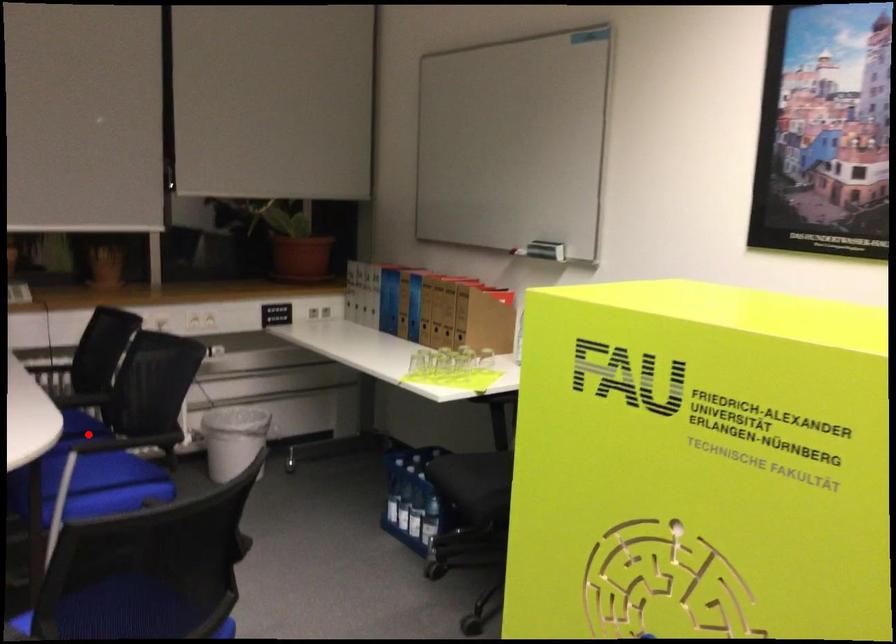
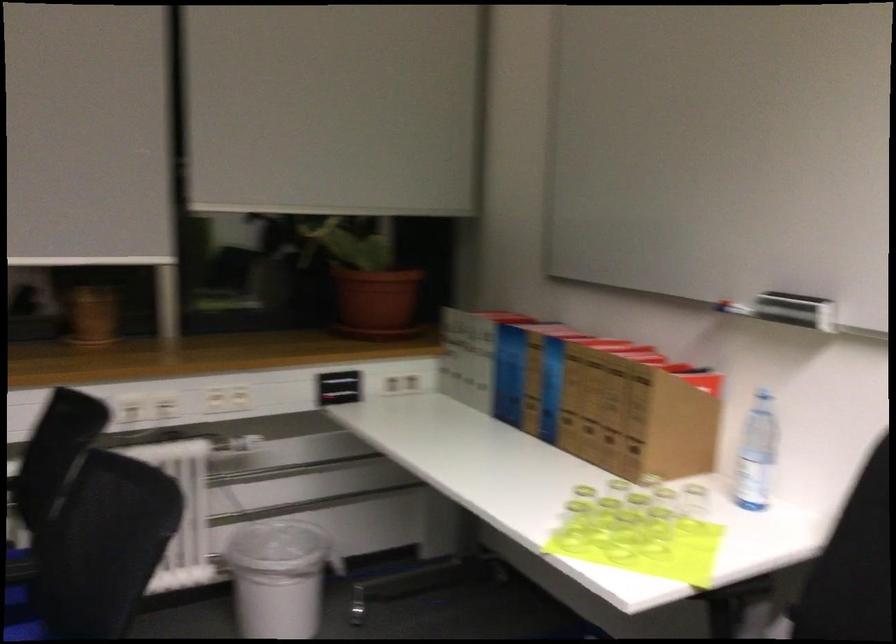
The point at the highlighted location is marked in the first image. Where is the corresponding point in the second image?

(23, 603)